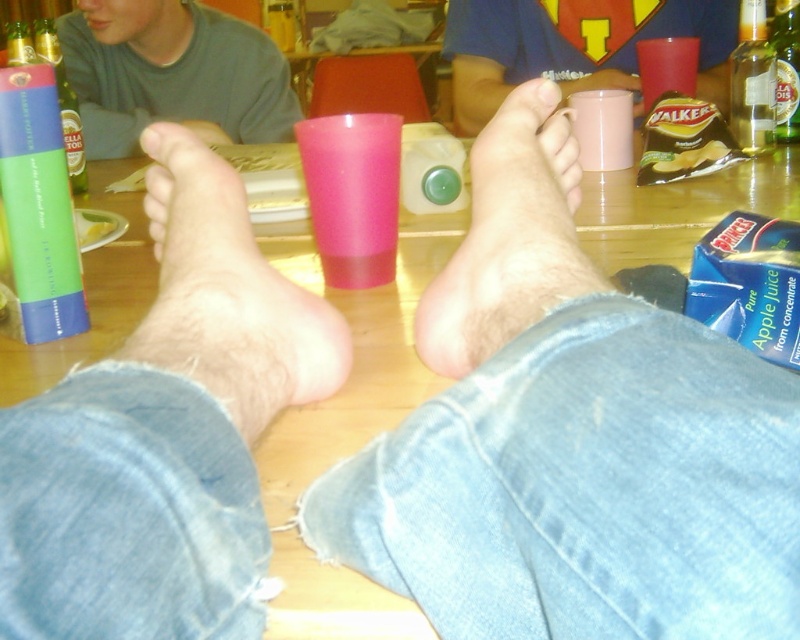
You are a guest at a party and want to grab a drink without moving your feet. You see the translucent glass bottle at upper right and the smooth skin toe at center. Which object is higher up?

The translucent glass bottle at upper right is above the smooth skin toe at center, so it is higher up.

You are a bartender preparing drinks for a party. You need to place the green matte bottle at upper left and the pink matte toe at center on a shelf. Which object should you place higher to ensure the taller one is visible?

The green matte bottle at upper left is taller than the pink matte toe at center, so place it higher on the shelf to ensure visibility.